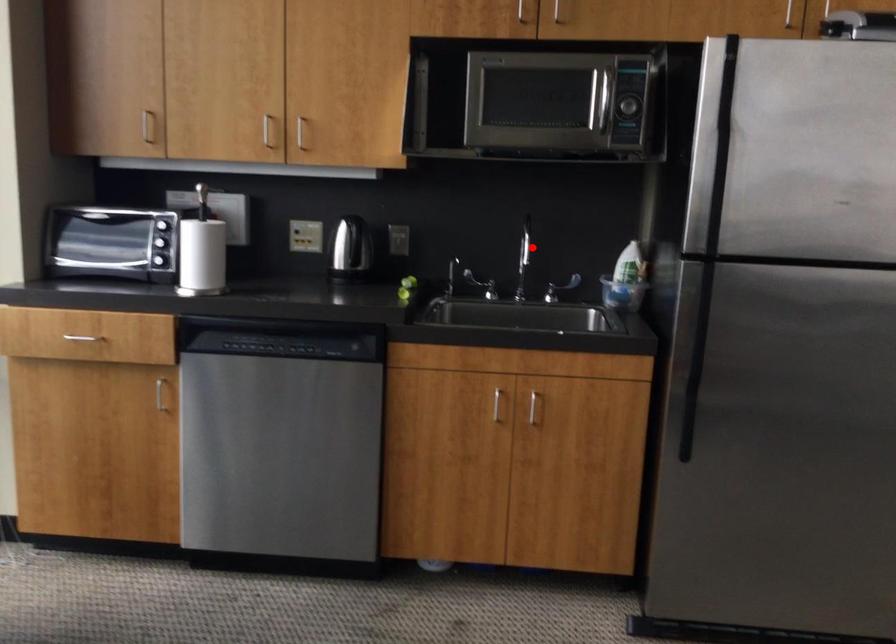
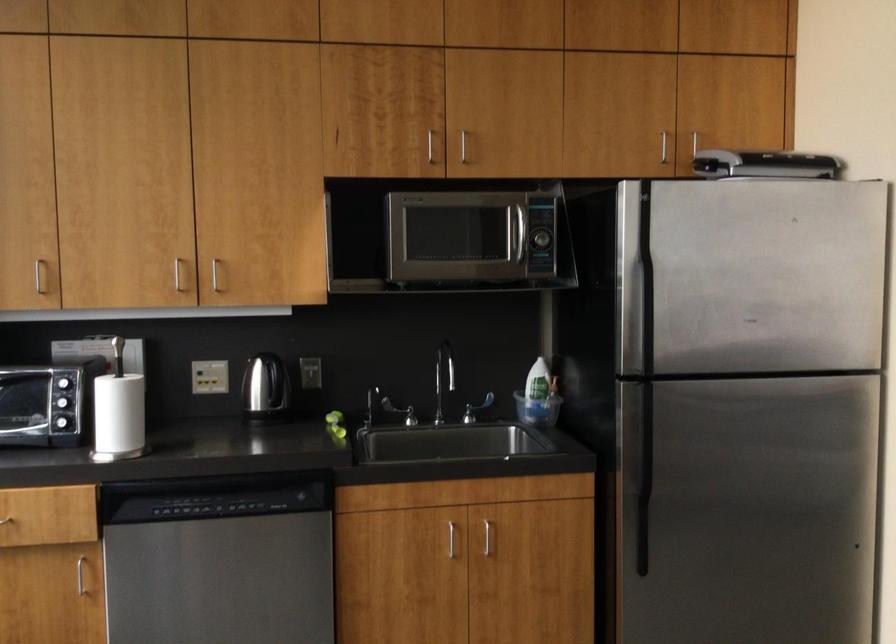
Find the pixel in the second image that matches the highlighted location in the first image.

(444, 371)